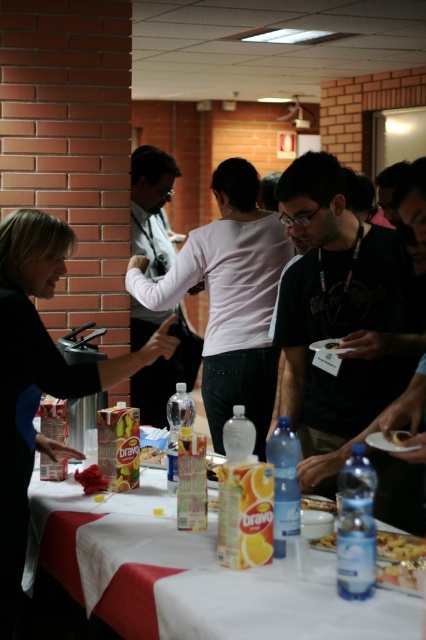
In the scene shown: You are a server in a busy event and need to deliver a drink to a guest wearing the black fabric shirt at left. You are currently standing near the golden crispy pizza at lower right. Can you reach the guest without moving more than 1 meter?

The distance between the black fabric shirt at left and the golden crispy pizza at lower right is 1.01 meters, which is slightly more than 1 meter. Therefore, you cannot reach the guest without moving more than 1 meter.